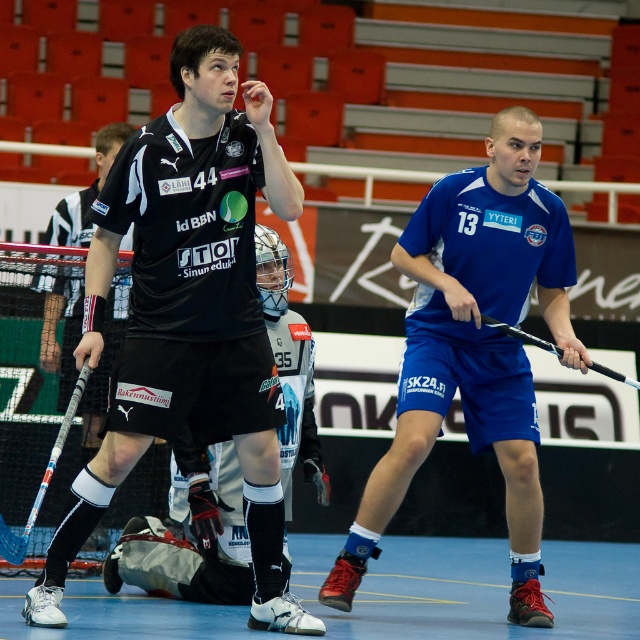
Is point (19, 538) positioned after point (509, 328)?

No, (19, 538) is in front of (509, 328).

Between point (17, 556) and point (525, 337), which one is positioned behind?

Positioned behind is point (525, 337).

Locate an element on the screen. Image resolution: width=640 pixels, height=640 pixels. white glossy hockey stick at lower left is located at coordinates (42, 480).

Between point (259, 440) and point (54, 458), which one is positioned in front?

Point (54, 458)

Who is more distant from viewer, [188,396] or [10,554]?

Positioned behind is point [10,554].

Identify the location of black matte jersey at center. (188, 310).

This screenshot has height=640, width=640. What are the coordinates of `black matte jersey at center` in the screenshot? It's located at (188, 310).

Does black matte jersey at center have a larger size compared to blue fabric shorts at center?

Correct, black matte jersey at center is larger in size than blue fabric shorts at center.

Locate an element on the screen. black matte jersey at center is located at coordinates (x=188, y=310).